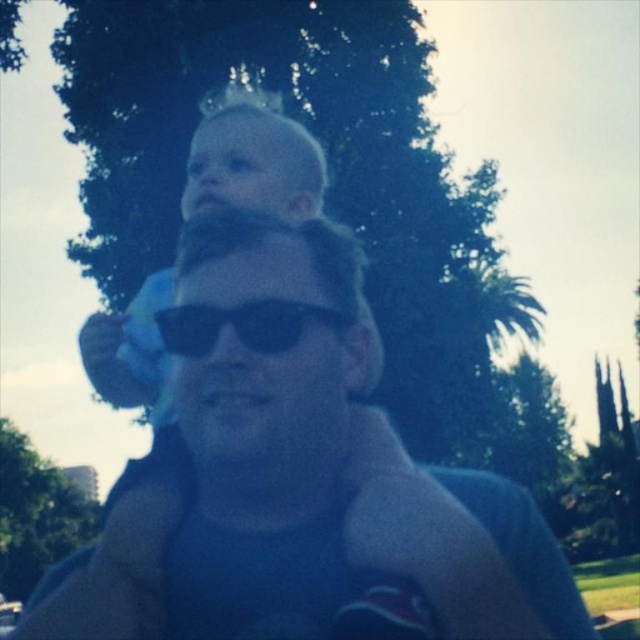
You are a photographer trying to capture a candid shot of the blue fabric shirt at center and the blonde hair baby at upper center. Based on their positions, which object should you focus on first to ensure both are in the frame?

The blue fabric shirt at center is to the right of the blonde hair baby at upper center. To ensure both are in the frame, focus on the blonde hair baby at upper center first since it is positioned to the left, allowing the shirt to naturally fall into the frame as you adjust.

You are a photographer trying to capture a clear photo of the black plastic sunglasses at center. However, the blonde hair baby at upper center is blocking your view. Can you adjust your position to see the sunglasses without moving the baby?

The black plastic sunglasses at center is behind the blonde hair baby at upper center, so moving your position slightly to the side or angle your camera might allow you to see around the baby to capture the sunglasses.